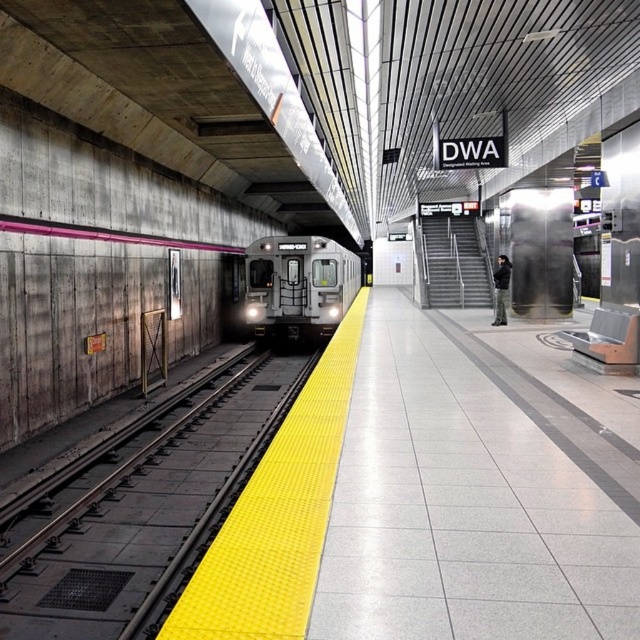
This screenshot has width=640, height=640. Describe the element at coordinates (140, 512) in the screenshot. I see `yellow textured platform at center` at that location.

Does yellow textured platform at center have a greater height compared to silver metallic train at center?

Incorrect, yellow textured platform at center's height is not larger of silver metallic train at center's.

Who is more forward, (28, 611) or (323, 301)?

Point (28, 611) is more forward.

Where is `yellow textured platform at center`? The image size is (640, 640). yellow textured platform at center is located at coordinates (140, 512).